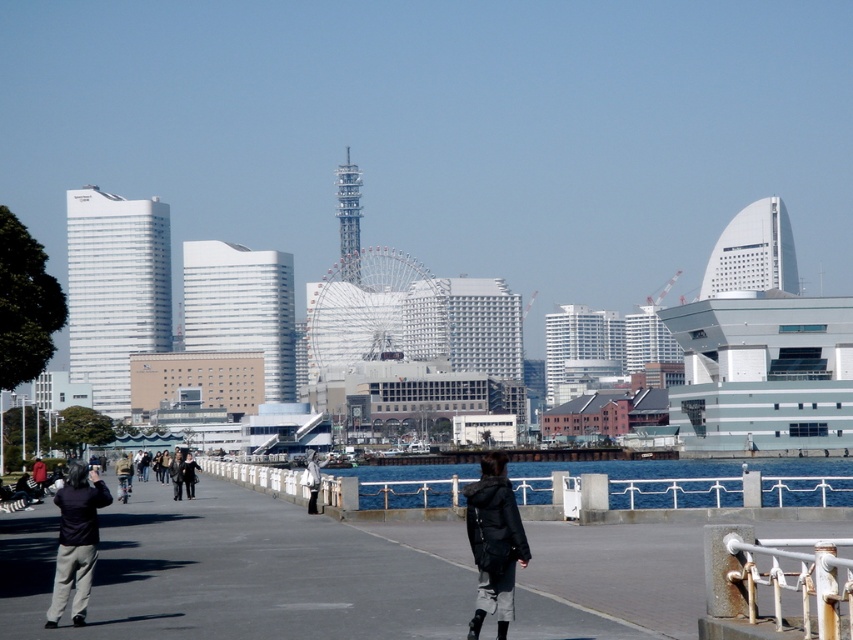
Is the position of rusty metal rail at lower right less distant than that of dark gray pants at lower left?

Yes, it is in front of dark gray pants at lower left.

Does point (811, 566) come behind point (61, 580)?

No, (811, 566) is closer to viewer.

Who is more forward, (802, 566) or (79, 502)?

Point (802, 566)

Locate an element on the screen. The height and width of the screenshot is (640, 853). rusty metal rail at lower right is located at coordinates (798, 579).

Does smooth concrete walkway at center appear under black matte jacket at center?

Correct, smooth concrete walkway at center is located below black matte jacket at center.

Is smooth concrete walkway at center smaller than black matte jacket at center?

Incorrect, smooth concrete walkway at center is not smaller in size than black matte jacket at center.

Which is in front, point (390, 589) or point (502, 632)?

Point (502, 632) is in front.

The image size is (853, 640). In order to click on smooth concrete walkway at center in this screenshot , I will do `click(231, 573)`.

What do you see at coordinates (492, 541) in the screenshot? I see `black matte jacket at center` at bounding box center [492, 541].

Who is more distant from viewer, [508,508] or [105,499]?

Point [105,499]

I want to click on black matte jacket at center, so click(492, 541).

This screenshot has height=640, width=853. In order to click on black matte jacket at center in this screenshot , I will do `click(492, 541)`.